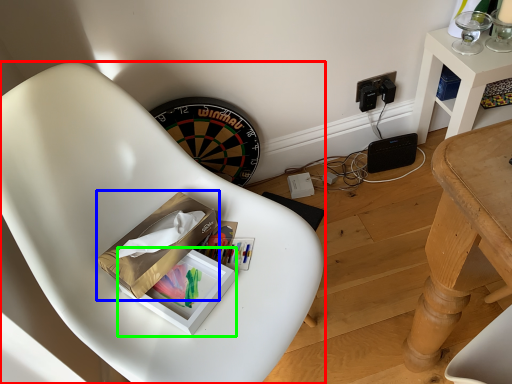
Question: Considering the real-world distances, which object is closest to chair (highlighted by a red box)? cardboard box (highlighted by a blue box) or box (highlighted by a green box).

Choices:
 (A) cardboard box
 (B) box

Answer: (A)